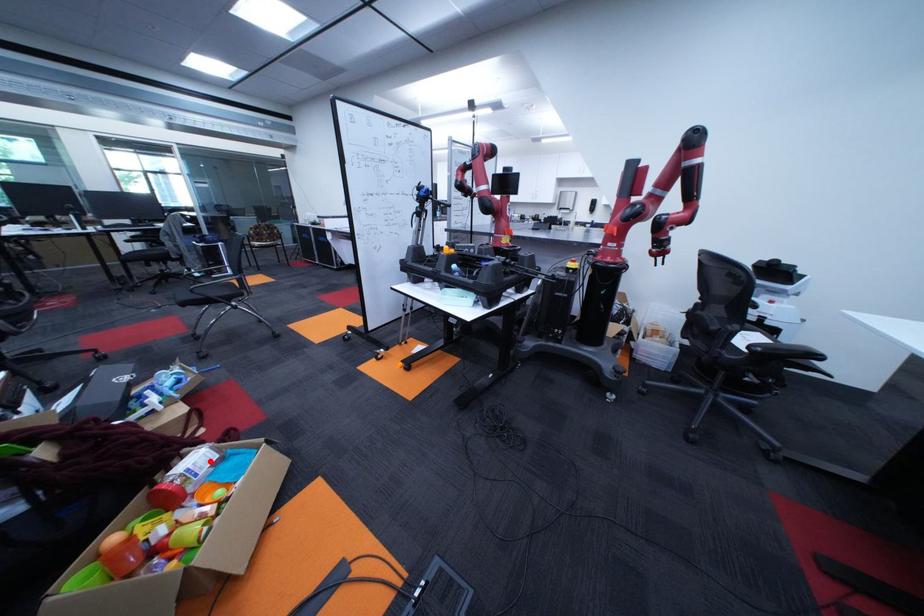
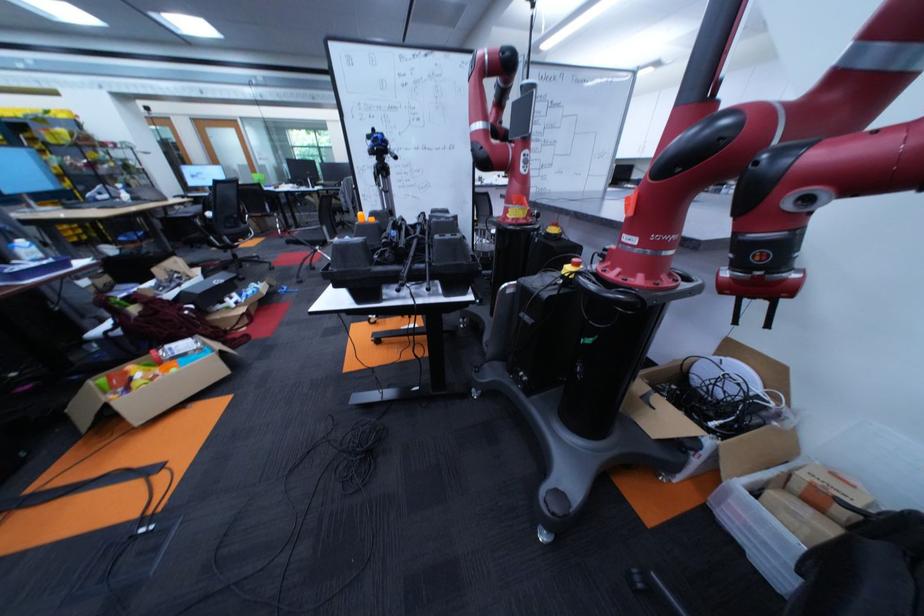
Question: I am providing you with two images of the same scene from different viewpoints. A red point is shown in image1. For the corresponding object point in image2, is it positioned nearer or farther from the camera?

Choices:
 (A) Nearer
 (B) Farther

Answer: (B)